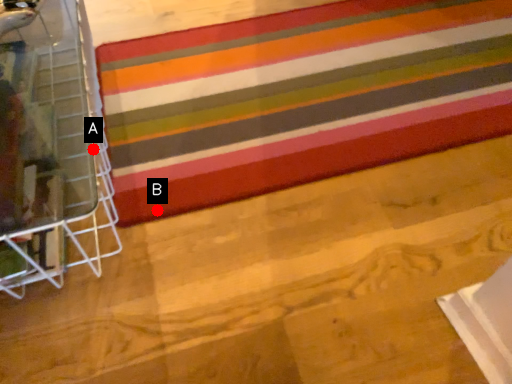
Question: Two points are circled on the image, labeled by A and B beside each circle. Which point is further to the camera?

Choices:
 (A) A is further
 (B) B is further

Answer: (B)